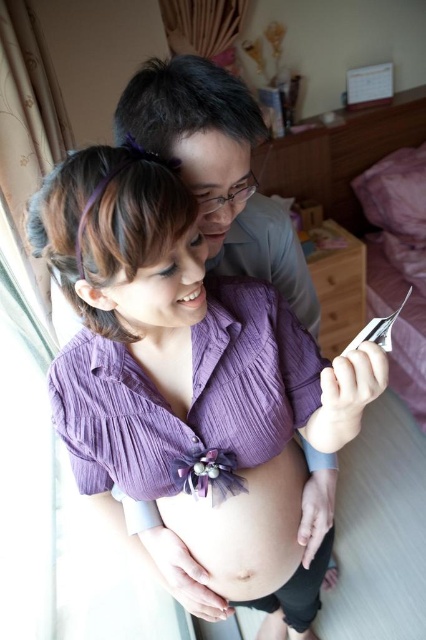
You are a photographer trying to capture the best angle of the purple crinkled blouse at center and the smooth purple fabric at center. Which one will appear larger in the photo?

The purple crinkled blouse at center will appear larger in the photo since it is closer to the viewer than the smooth purple fabric at center.